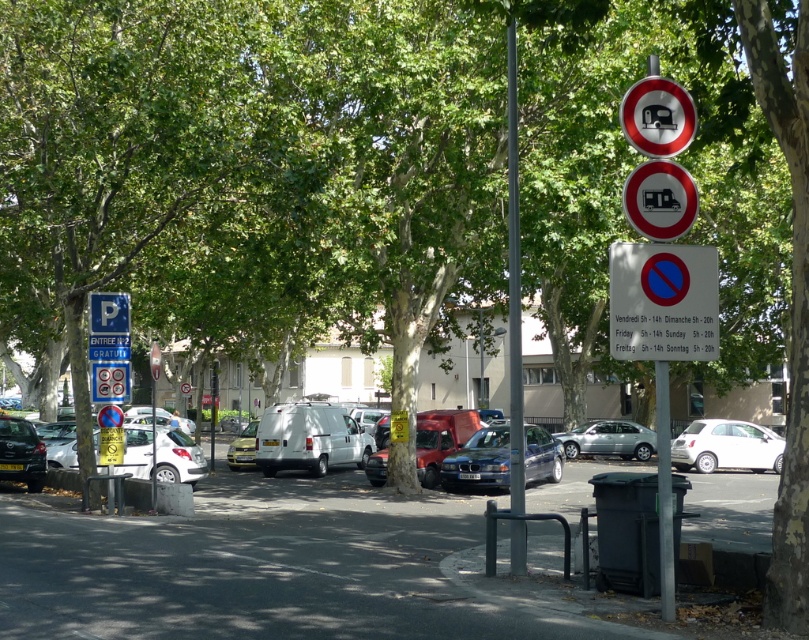
Is silver metallic sedan at center further to the viewer compared to shiny black car at lower left?

Yes.

Which is above, silver metallic sedan at center or shiny black car at lower left?

shiny black car at lower left is higher up.

Which is in front, point (642, 429) or point (24, 467)?

Point (24, 467) is more forward.

Find the location of a particular element. silver metallic sedan at center is located at coordinates (608, 440).

Is white plastic sign at center smaller than metallic silver van at center?

Yes.

Is white plastic sign at center thinner than metallic silver van at center?

Yes.

At what (x,y) coordinates should I click in order to perform the action: click on white plastic sign at center. Please return your answer as a coordinate pair (x, y). This screenshot has height=640, width=809. Looking at the image, I should click on (663, 301).

I want to click on white plastic sign at center, so click(663, 301).

Which is above, white matte van at center or silver metallic pole at center?

Positioned higher is silver metallic pole at center.

Does point (297, 413) come in front of point (511, 509)?

No, it is behind (511, 509).

Locate an element on the screen. The width and height of the screenshot is (809, 640). white matte van at center is located at coordinates (308, 438).